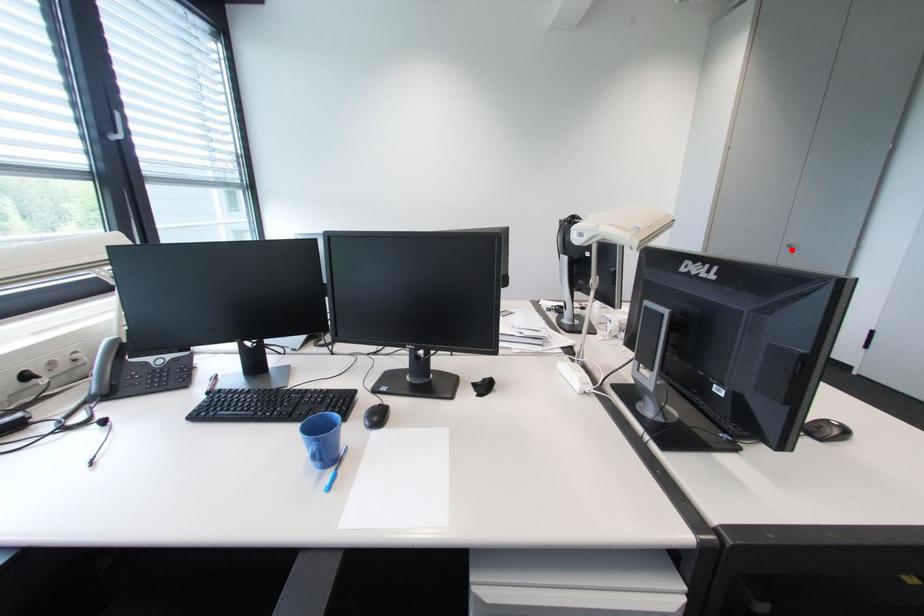
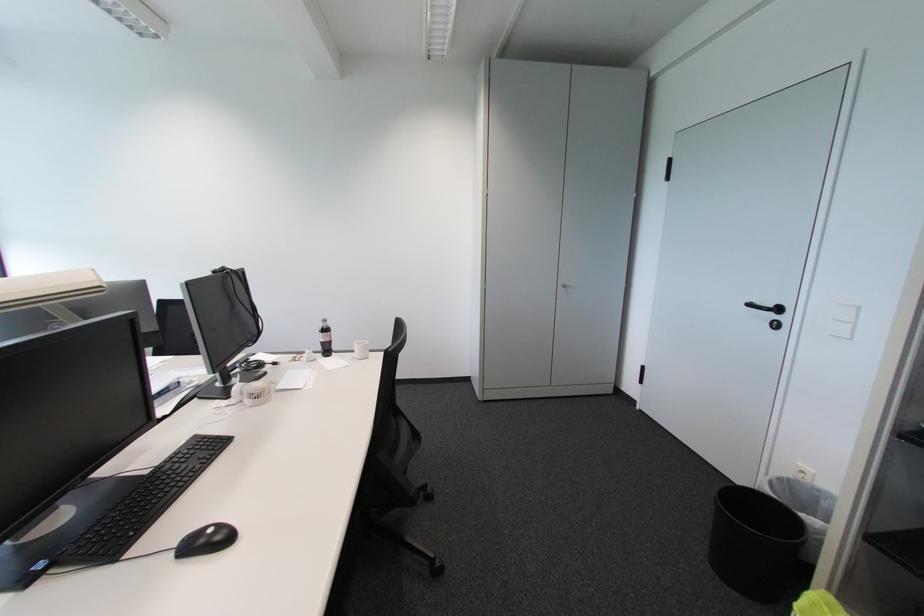
Locate, in the second image, the point that corresponds to the highlighted location in the first image.

(567, 290)